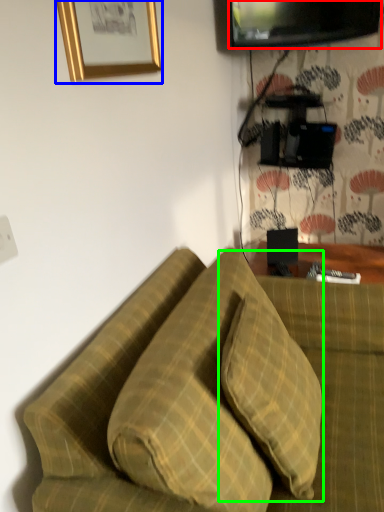
Question: Estimate the real-world distances between objects in this image. Which object is closer to television (highlighted by a red box), picture frame (highlighted by a blue box) or pillow (highlighted by a green box)?

Choices:
 (A) picture frame
 (B) pillow

Answer: (A)